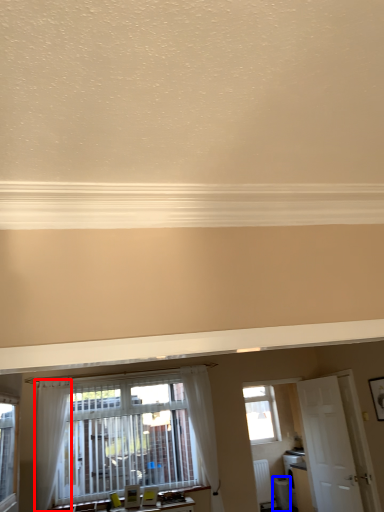
Question: Which point is further to the camera, curtain (highlighted by a red box) or appliance (highlighted by a blue box)?

Choices:
 (A) curtain
 (B) appliance

Answer: (B)